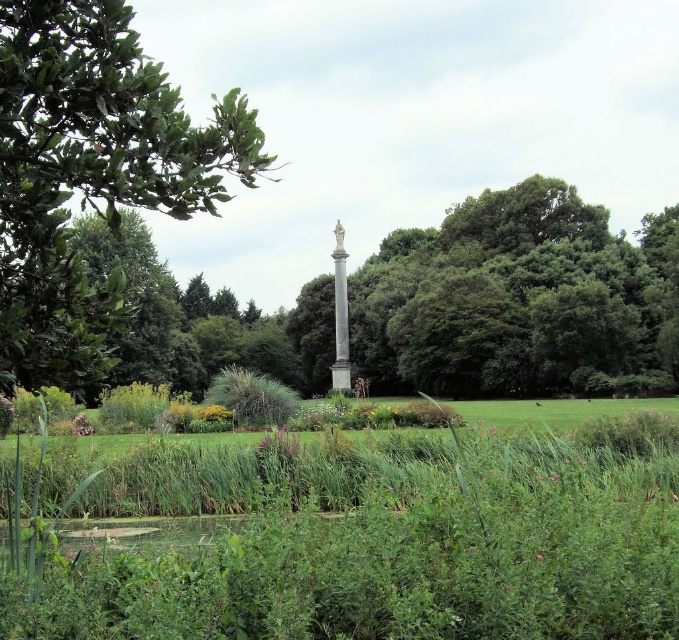
You are standing at the center of the park and want to locate the green leafy tree at upper left. Which direction should you face to see it?

To locate the green leafy tree at upper left, you should face the upper left direction since it is located at point (91, 173).

You are standing in the park and want to place a 10 meter long bench between the green grassy field at center and the green leafy tree at upper left. Will the bench fit between them?

The distance between the green grassy field at center and the green leafy tree at upper left is 9.36 meters. Since the bench is 10 meters long, it will not fit between them as the space is shorter than the bench.